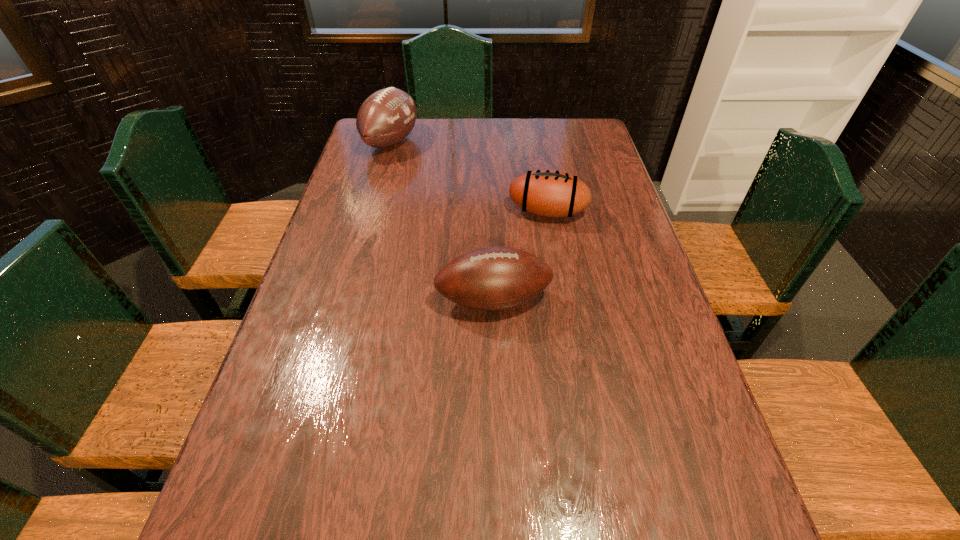
This screenshot has width=960, height=540. I want to click on the leftmost object, so click(386, 117).

Where is `the farthest football (American)`? the farthest football (American) is located at coordinates (386, 117).

At what (x,y) coordinates should I click in order to perform the action: click on the nearest football (American). Please return your answer as a coordinate pair (x, y). This screenshot has width=960, height=540. Looking at the image, I should click on (494, 278).

Where is `the second nearest object`? This screenshot has width=960, height=540. the second nearest object is located at coordinates (548, 193).

The image size is (960, 540). I want to click on vacant space located 0.130m on the front of the leftmost object, so click(x=380, y=184).

Find the location of a particular element. Image resolution: width=960 pixels, height=540 pixels. vacant space located on the front of the nearest object is located at coordinates (498, 475).

Locate an element on the screen. The width and height of the screenshot is (960, 540). blank space located 0.090m on the front of the second farthest object is located at coordinates (554, 248).

Locate an element on the screen. This screenshot has height=540, width=960. object that is positioned at the far edge is located at coordinates (386, 117).

Locate an element on the screen. This screenshot has width=960, height=540. object that is at the left edge is located at coordinates (386, 117).

You are a GUI agent. You are given a task and a screenshot of the screen. Output one action in this format:
    pyautogui.click(x=<x>, y=<y>)
    Task: Click on the object present at the right edge
    The image size is (960, 540).
    Given the screenshot: What is the action you would take?
    pyautogui.click(x=548, y=193)